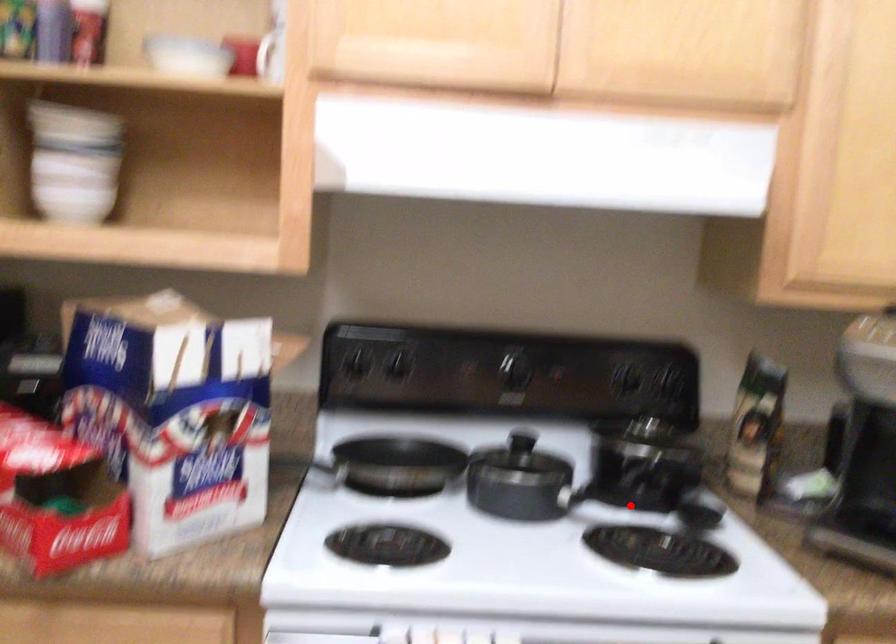
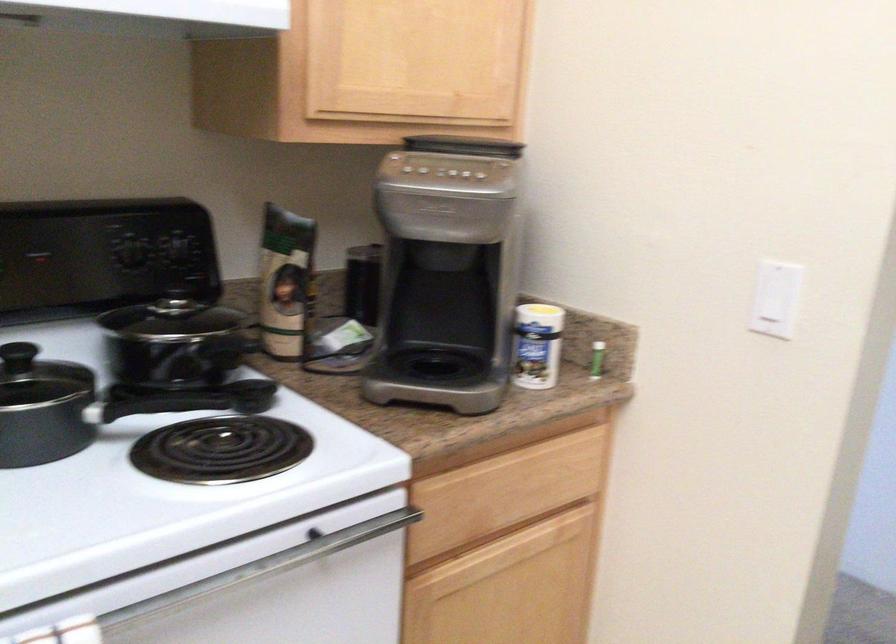
Question: A red point is marked in image1. In image2, is the corresponding 3D point closer to the camera or farther? Reply with the corresponding letter.

Choices:
 (A) The corresponding 3D point is closer.
 (B) The corresponding 3D point is farther.

Answer: (A)